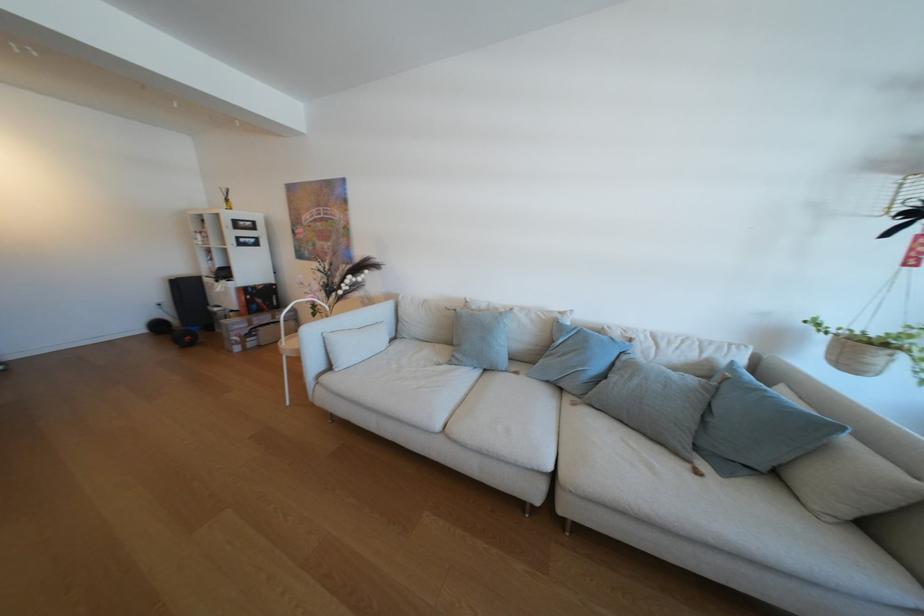
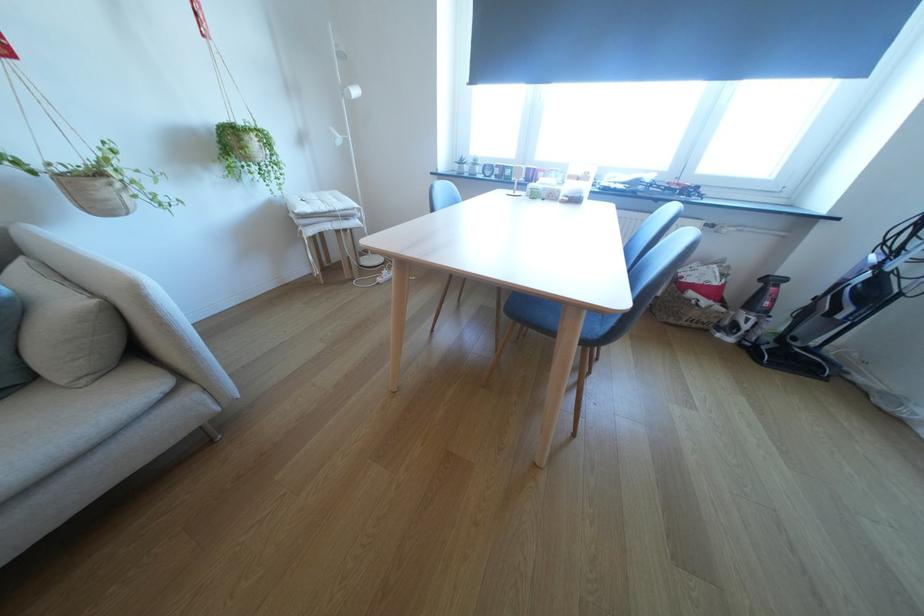
In the scene shown: First-person continuous shooting, in which direction is the camera rotating?

The camera's rotation is toward right-down.